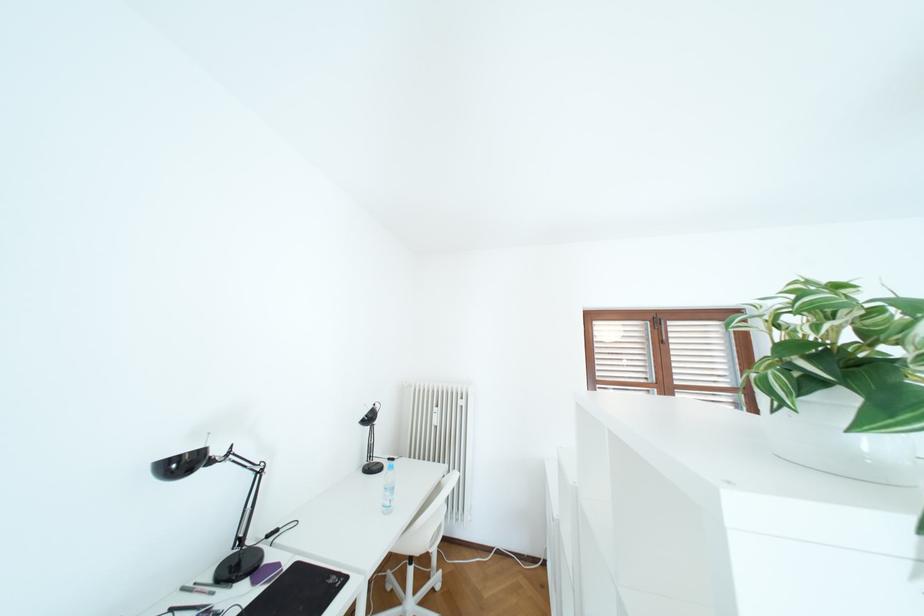
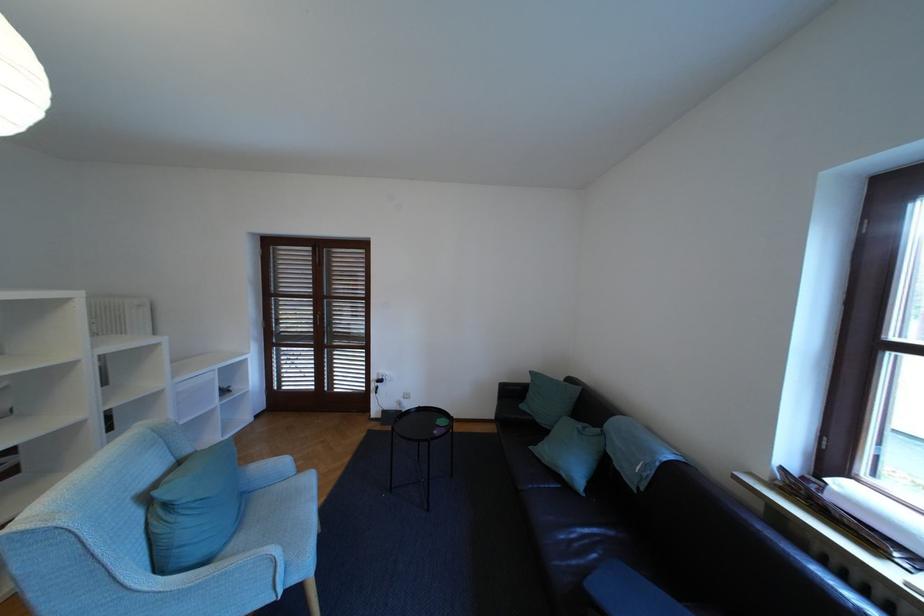
In a continuous first-person perspective shot, in which direction is the camera moving?

The cameraman moved toward right, backward.